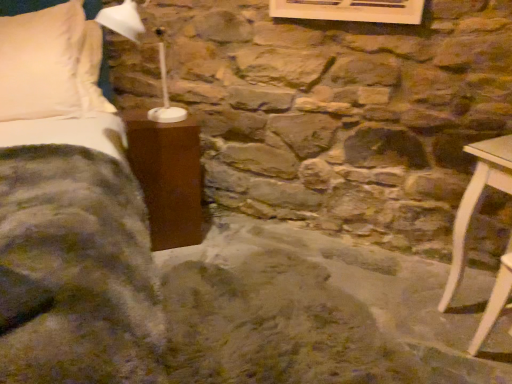
Locate an element on the screen. This screenshot has height=384, width=512. vacant space in white wood chair at lower right, placed as the first furniture when sorted from front to back (from a real-world perspective) is located at coordinates (498, 361).